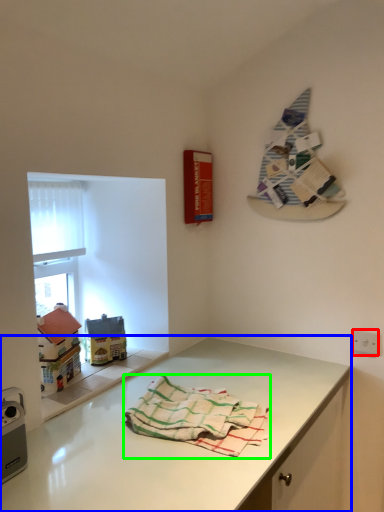
Question: Based on their relative distances, which object is nearer to electric outlet (highlighted by a red box)? Choose from countertop (highlighted by a blue box) and towel (highlighted by a green box).

Choices:
 (A) countertop
 (B) towel

Answer: (A)